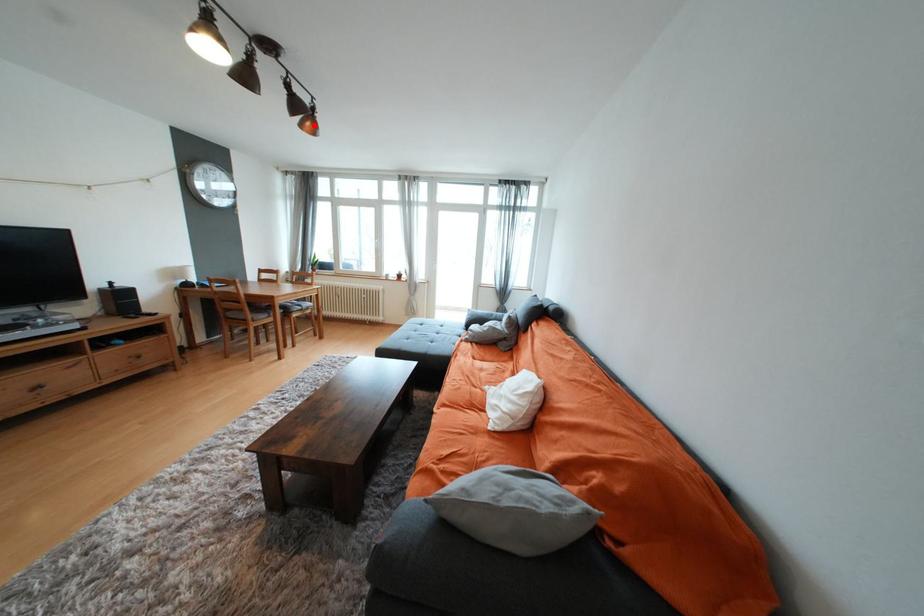
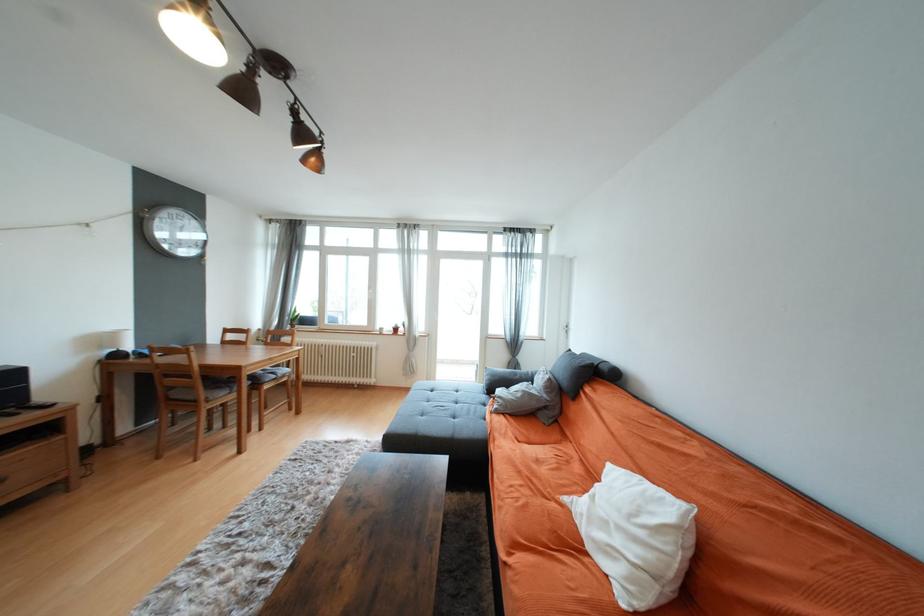
The point at the highlighted location is marked in the first image. Where is the corresponding point in the second image?

(319, 161)